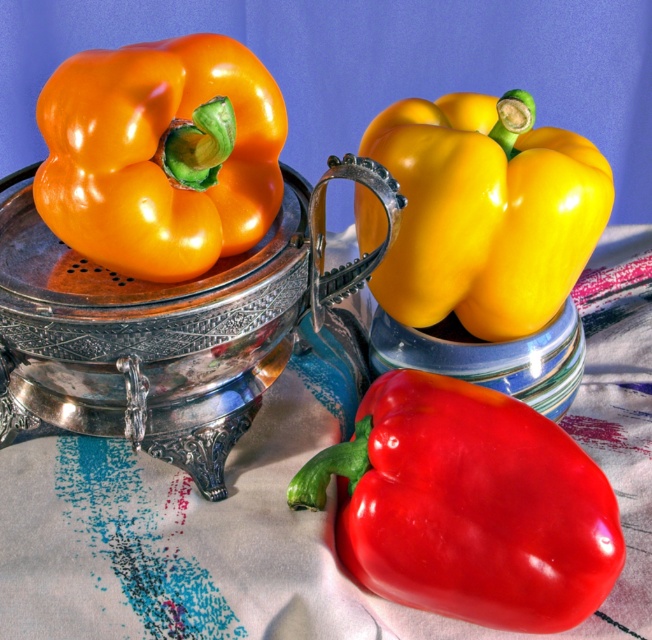
Who is lower down, orange glossy bell pepper at upper left or yellow glossy bell pepper at center?

Positioned lower is yellow glossy bell pepper at center.

Is point (276, 204) behind point (396, 308)?

No, (276, 204) is in front of (396, 308).

Between point (61, 227) and point (482, 266), which one is positioned in front?

Point (61, 227) is in front.

Locate an element on the screen. The width and height of the screenshot is (652, 640). orange glossy bell pepper at upper left is located at coordinates (160, 154).

Can you confirm if glossy red bell pepper at lower center is positioned below yellow glossy bell pepper at center?

Indeed, glossy red bell pepper at lower center is positioned under yellow glossy bell pepper at center.

Consider the image. Is glossy red bell pepper at lower center closer to the viewer compared to yellow glossy bell pepper at center?

Yes, it is.

Measure the distance between point (462, 557) and camera.

Point (462, 557) is 15.08 inches from camera.

You are a GUI agent. You are given a task and a screenshot of the screen. Output one action in this format:
    pyautogui.click(x=<x>, y=<y>)
    Task: Click on the glossy red bell pepper at lower center
    This screenshot has height=640, width=652.
    Given the screenshot: What is the action you would take?
    pyautogui.click(x=467, y=506)

Is glossy red bell pepper at lower center thinner than orange glossy bell pepper at upper left?

No, glossy red bell pepper at lower center is not thinner than orange glossy bell pepper at upper left.

Who is more distant from viewer, (422, 524) or (108, 168)?

Positioned behind is point (108, 168).

What do you see at coordinates (467, 506) in the screenshot? I see `glossy red bell pepper at lower center` at bounding box center [467, 506].

Identify the location of glossy red bell pepper at lower center. (467, 506).